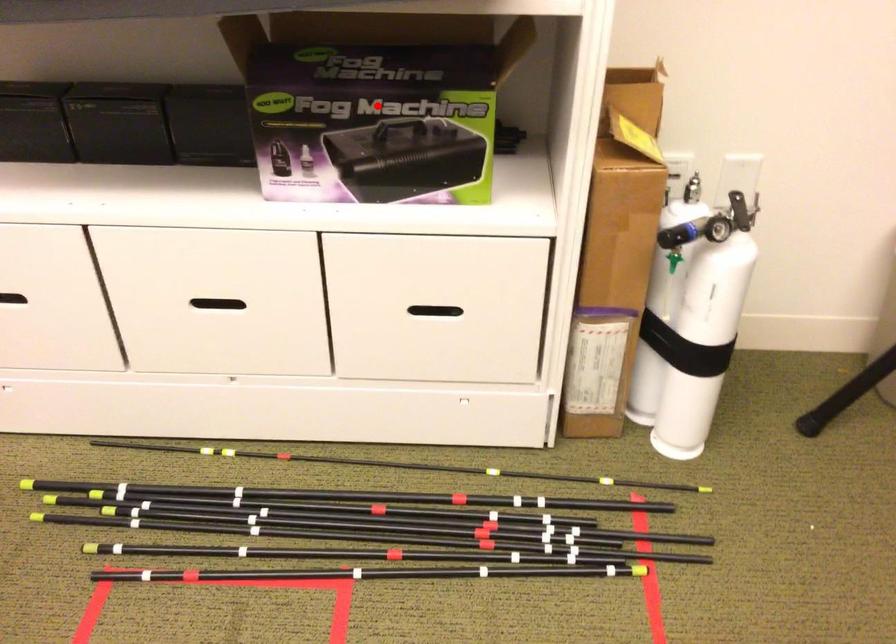
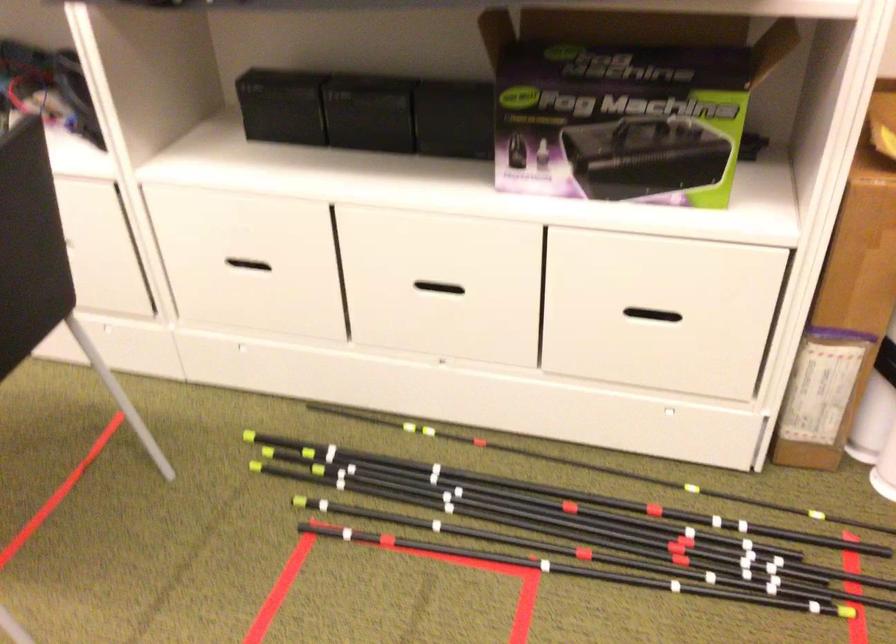
The point at the highlighted location is marked in the first image. Where is the corresponding point in the second image?

(625, 102)